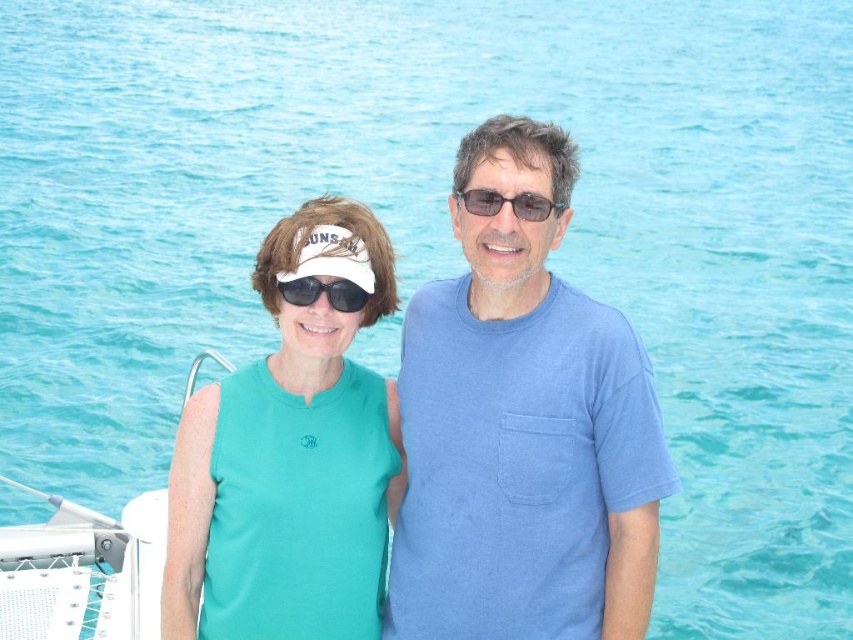
Question: Which point is closer to the camera?

Choices:
 (A) black reflective sunglasses at center
 (B) glossy plastic sunglasses at center
 (C) light blue cotton t-shirt at center
 (D) teal fabric visor at left

Answer: (A)

Question: Can you confirm if teal fabric visor at left is bigger than black reflective sunglasses at center?

Choices:
 (A) yes
 (B) no

Answer: (B)

Question: Does light blue cotton t-shirt at center appear on the right side of black reflective sunglasses at center?

Choices:
 (A) no
 (B) yes

Answer: (B)

Question: Does light blue cotton t-shirt at center have a smaller size compared to glossy plastic sunglasses at center?

Choices:
 (A) no
 (B) yes

Answer: (B)

Question: Estimate the real-world distances between objects in this image. Which object is closer to the teal fabric visor at left?

Choices:
 (A) black reflective sunglasses at center
 (B) light blue cotton t-shirt at center

Answer: (A)

Question: Estimate the real-world distances between objects in this image. Which object is closer to the glossy plastic sunglasses at center?

Choices:
 (A) light blue cotton t-shirt at center
 (B) teal fabric visor at left

Answer: (A)